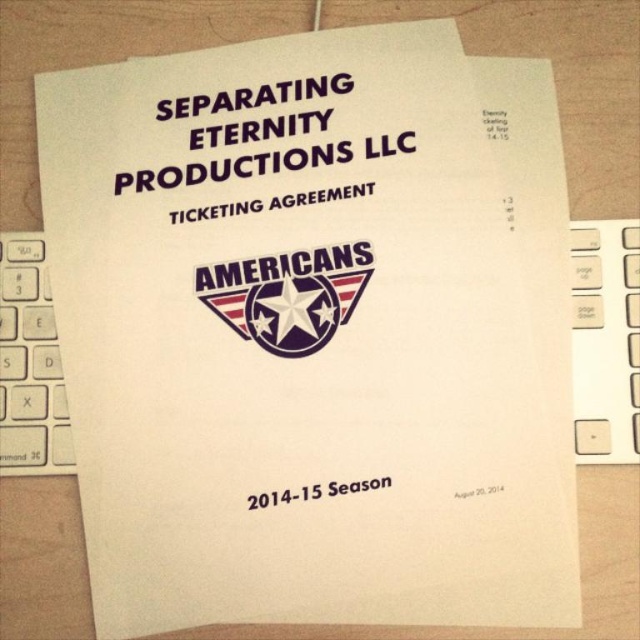
Who is positioned more to the left, white plastic keyboard at upper center or metallic silver star at center?

From the viewer's perspective, metallic silver star at center appears more on the left side.

Is white plastic keyboard at upper center below metallic silver star at center?

Indeed, white plastic keyboard at upper center is positioned under metallic silver star at center.

I want to click on white plastic keyboard at upper center, so click(x=605, y=340).

Locate an element on the screen. Image resolution: width=640 pixels, height=640 pixels. white plastic keyboard at upper center is located at coordinates coord(605,340).